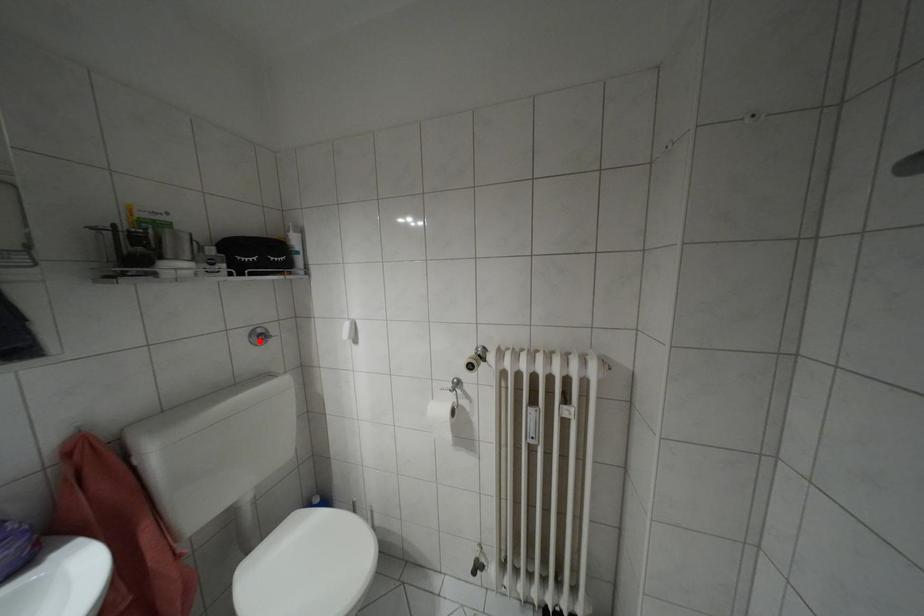
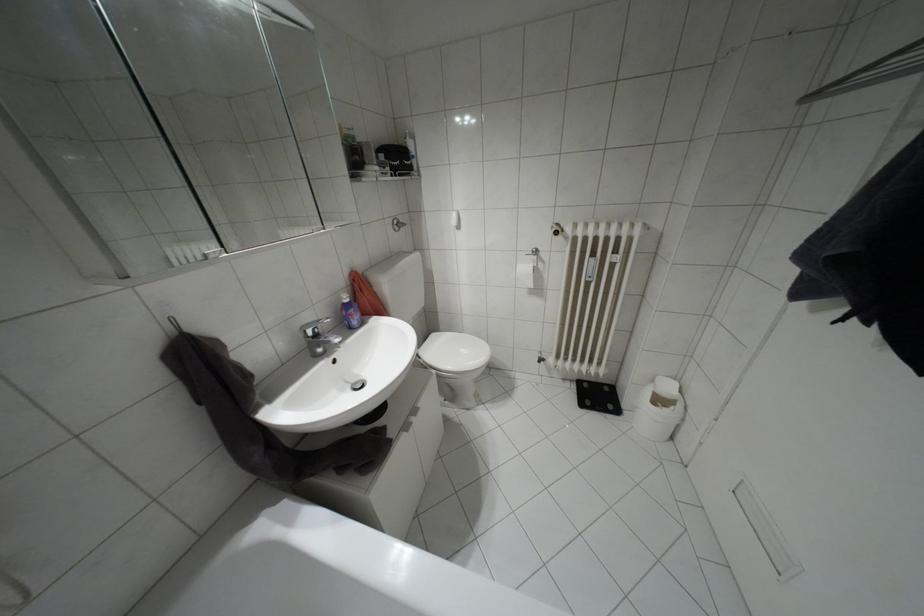
Question: I am providing you with two images of the same scene from different viewpoints. In image1, a red point is highlighted. Considering the same 3D point in image2, which of the following is correct?

Choices:
 (A) It is closer
 (B) It is farther

Answer: (A)